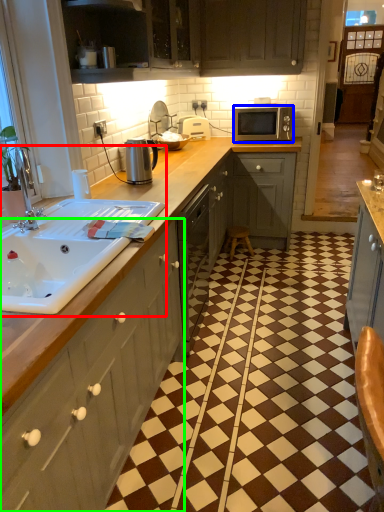
Question: Which object is positioned farthest from sink (highlighted by a red box)? Select from microwave oven (highlighted by a blue box) and cabinetry (highlighted by a green box).

Choices:
 (A) microwave oven
 (B) cabinetry

Answer: (A)